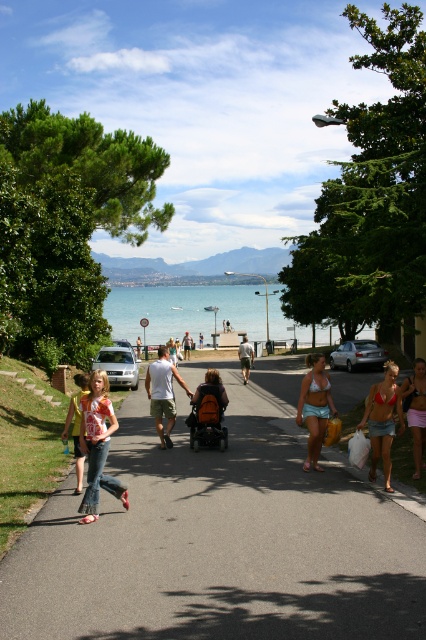
Does gray asphalt road at center have a larger size compared to matte black tank top at center?

Correct, gray asphalt road at center is larger in size than matte black tank top at center.

Is point (232, 358) behind point (420, 404)?

Yes, point (232, 358) is behind point (420, 404).

Is point (224, 481) closer to camera compared to point (423, 413)?

No, (224, 481) is further to viewer.

The image size is (426, 640). Find the location of `gray asphalt road at center`. gray asphalt road at center is located at coordinates (221, 536).

Does blue water at center appear on the right side of teal fabric bikini top at center?

Correct, you'll find blue water at center to the right of teal fabric bikini top at center.

Who is more forward, (155, 285) or (325, 384)?

Point (325, 384)

Find the location of a particular element. Image resolution: width=426 pixels, height=640 pixels. blue water at center is located at coordinates (184, 310).

Does blue water at center lie in front of denim jeans at left?

No, it is not.

Which is more to the right, blue water at center or denim jeans at left?

blue water at center is more to the right.

Between point (170, 300) and point (109, 428), which one is positioned in front?

Point (109, 428) is in front.

Locate an element on the screen. blue water at center is located at coordinates (184, 310).